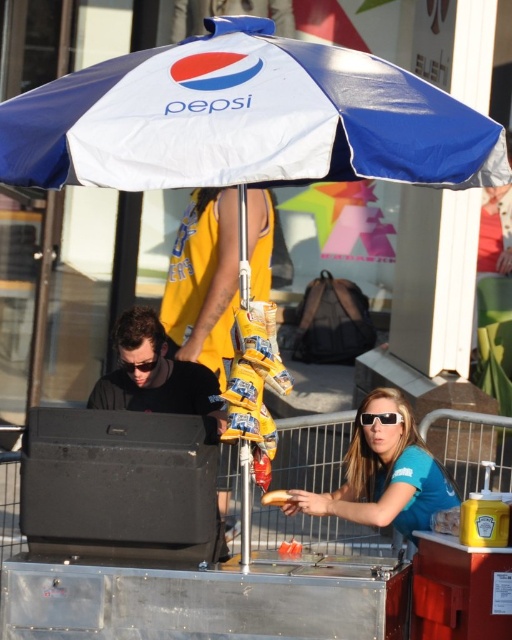
You are a customer at the food stall and want to grab both the clear plastic sunglasses at lower center and the golden crispy french fry at center. Which item should you reach for first to avoid blocking your view of the other?

You should reach for the clear plastic sunglasses at lower center first because it is closer to you, so grabbing it first won

You are a customer at the food stall and want to grab the blue fabric sunglasses at center to try them on. However, there is a black matte speaker at lower left in the way. Can you reach the sunglasses without moving the speaker?

The blue fabric sunglasses at center is positioned under the black matte speaker at lower left, so you can reach the sunglasses by moving the speaker out of the way first.

You are a customer at the food stall and want to know where the clear plastic sunglasses at lower center are located. Can you describe their position using coordinates?

The clear plastic sunglasses at lower center are located at coordinates point (x=379, y=417).